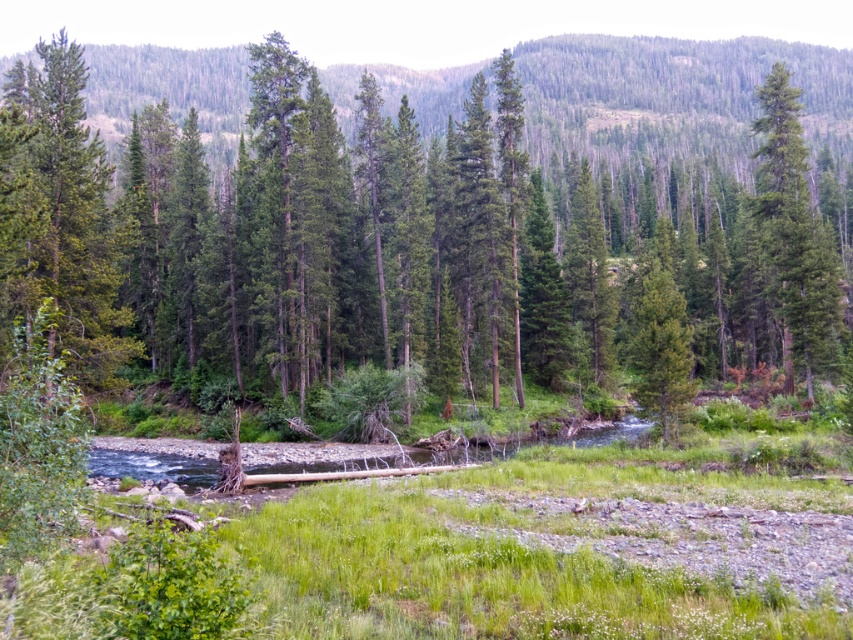
You are standing in the forest and want to walk from the point at coordinates point (398, 326) to the point at coordinates point (84, 161). Which direction should you move to get closer to your destination?

You should move away from the viewer because point (398, 326) is further to the viewer than point (84, 161), so moving away from the viewer will take you towards the destination.

You are a hiker who wants to take a photo of both the green matte tree at left and the green matte tree at right in the same frame. Which tree should you move closer to if you want both trees to appear equally sized in your photo?

You should move closer to the green matte tree at right because it is smaller than the green matte tree at left. By moving closer to the smaller tree, you can balance their apparent sizes in the photo.

You are standing at the point labeled point (438, 225) in the forest. Based on the scene description, which object from the list is directly beneath your feet?

The point labeled point (438, 225) is on the green matte tree at center, so the object directly beneath your feet is the green matte tree at center.